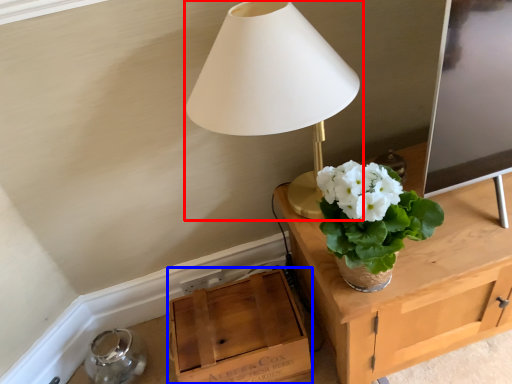
Question: Which point is closer to the camera, lamp (highlighted by a red box) or cardboard box (highlighted by a blue box)?

Choices:
 (A) lamp
 (B) cardboard box

Answer: (A)